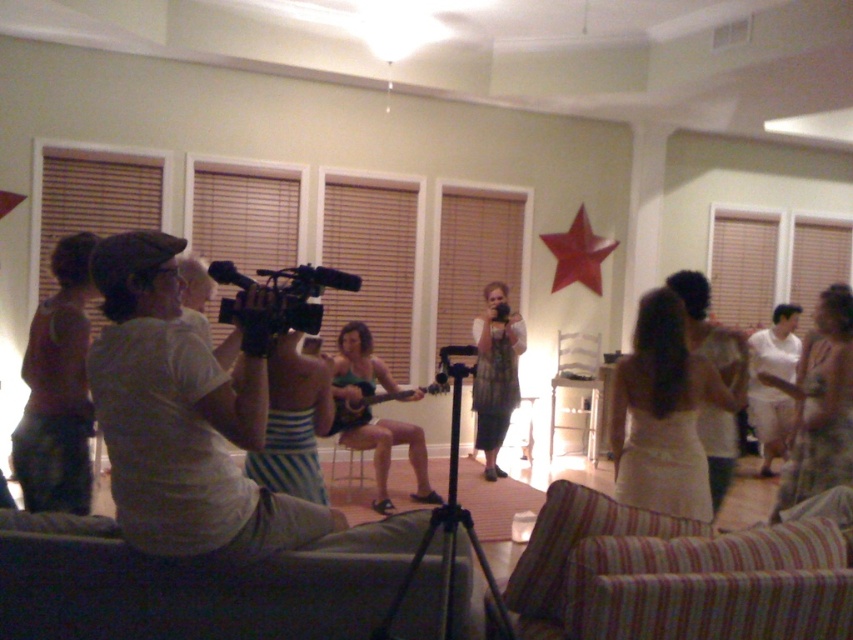
You are setting up a video camera for a presentation in the living room. The black metal tripod at center is placed at coordinates 0.822 on the x and 0.525 on the y. If the room has a coordinate system where the bottom left corner is 0,0 and the top right is 1,1, where exactly is the tripod positioned?

The black metal tripod at center is located at point 0.822 on the x and 0.525 on the y in the room coordinate system.

Based on the photo, you are setting up a video camera for a small event in a living room. You have a black metal tripod at center and a black plastic video camera at center. Which object takes up more space in the room?

The black plastic video camera at center takes up more space than the black metal tripod at center.

You are a photographer trying to capture a group photo of two people in the scene. The people you need to photograph are the matte brown shirt at left and the patterned fabric dress at center. Based on their positions, can you position yourself so that both are fully visible in the frame without any part of them being cut off?

Yes, since the matte brown shirt at left is positioned to the left of the patterned fabric dress at center, you can center your camera between them to ensure both are fully visible in the frame.